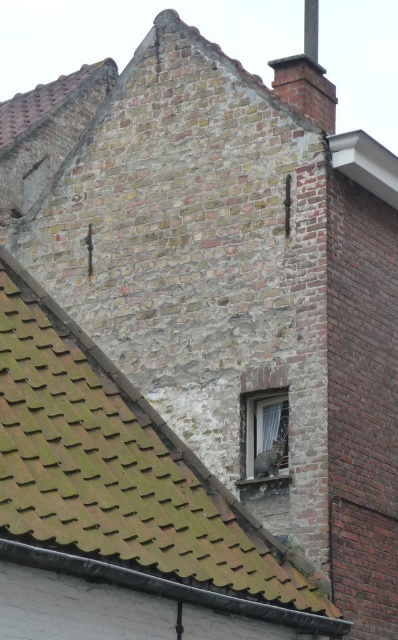
You are standing at the base of the brick building and want to place a ladder against the brick chimney at upper right. If the ladder is 15 feet long, will it reach the chimney?

The distance between you and the brick chimney at upper right is 155.73 feet, which is much greater than the ladder length of 15 feet. Therefore, the ladder will not reach the chimney.

In the scene shown: You are standing in front of the brick building and want to place a decorative plaque between the brown shingles at upper left and the brick chimney at upper right. Based on their positions, where should you place the plaque?

The brown shingles at upper left is to the left of brick chimney at upper right, so you should place the plaque between them, ensuring it is centered between the two objects.

You are standing in front of the brick building and want to hang a new decoration. The decoration requires a hook that can be placed either on the brick chimney at upper right or the white sheer curtain at center. Based on their positions, which object is farther to your right?

The brick chimney at upper right is farther to your right compared to the white sheer curtain at center because it is positioned to the right of it.